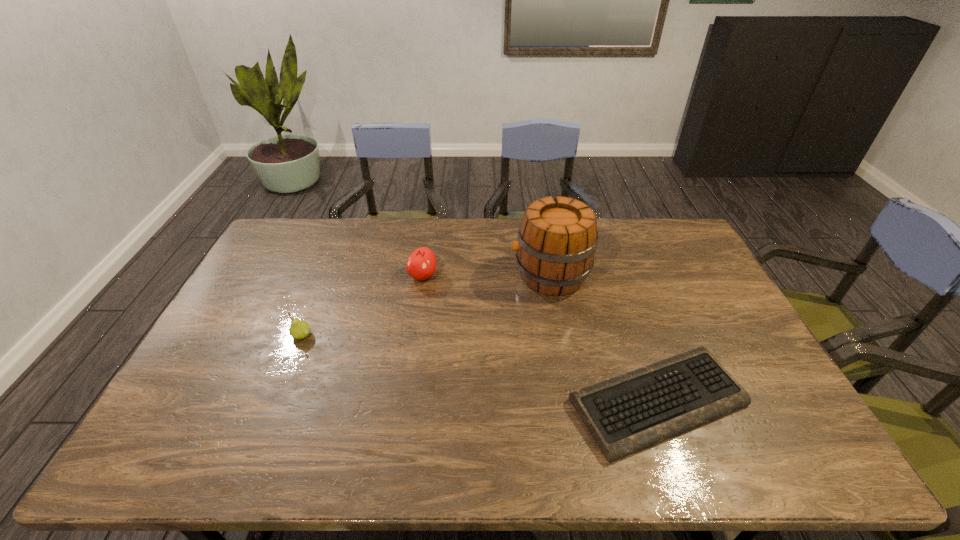
You are a GUI agent. You are given a task and a screenshot of the screen. Output one action in this format:
    pyautogui.click(x=<x>, y=<y>)
    Task: Click on the tallest object
    
    Given the screenshot: What is the action you would take?
    pyautogui.click(x=557, y=238)

I want to click on apple, so click(421, 264).

Image resolution: width=960 pixels, height=540 pixels. In order to click on the third shortest object in this screenshot , I will do `click(421, 264)`.

The height and width of the screenshot is (540, 960). Identify the location of pear. (299, 329).

At what (x,y) coordinates should I click in order to perform the action: click on the third tallest object. Please return your answer as a coordinate pair (x, y). Looking at the image, I should click on (299, 329).

This screenshot has width=960, height=540. I want to click on computer keyboard, so click(625, 414).

At what (x,y) coordinates should I click in order to perform the action: click on the shortest object. Please return your answer as a coordinate pair (x, y). Looking at the image, I should click on (625, 414).

This screenshot has width=960, height=540. What are the coordinates of `vacant space located on the side of the cider where the spigot is located` in the screenshot? It's located at (469, 275).

What are the coordinates of `vacant space situated 0.130m on the side of the cider where the spigot is located` in the screenshot? It's located at (472, 275).

The image size is (960, 540). What are the coordinates of `vacant area situated on the side of the cider where the spigot is located` in the screenshot? It's located at (478, 275).